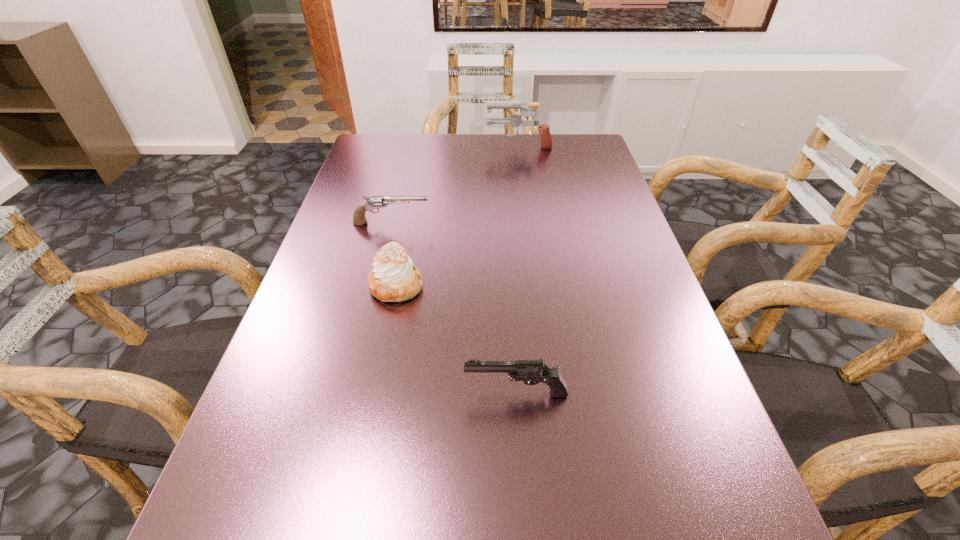
What are the coordinates of `vacant space located 0.330m at the end of the barrel of the nearest object` in the screenshot? It's located at (267, 393).

This screenshot has height=540, width=960. In order to click on vacant space situated 0.130m at the end of the barrel of the nearest object in this screenshot , I will do `click(387, 393)`.

Find the location of `vacant space located 0.170m at the end of the barrel of the nearest object`. vacant space located 0.170m at the end of the barrel of the nearest object is located at coordinates pyautogui.click(x=363, y=393).

Locate an element on the screen. This screenshot has height=540, width=960. free region located aiming along the barrel of the leftmost gun is located at coordinates (540, 223).

This screenshot has width=960, height=540. I want to click on object located in the far edge section of the desktop, so click(x=515, y=120).

Identify the location of pastry at the left edge. (393, 278).

Where is `gun at the left edge`? gun at the left edge is located at coordinates (374, 202).

Identify the location of object present at the right edge. The height and width of the screenshot is (540, 960). (515, 120).

Where is `object that is at the far right corner`? This screenshot has width=960, height=540. object that is at the far right corner is located at coordinates (515, 120).

You are a GUI agent. You are given a task and a screenshot of the screen. Output one action in this format:
    pyautogui.click(x=<x>, y=<y>)
    Task: Click on the vacant region at the far edge of the desktop
    Image resolution: width=960 pixels, height=540 pixels.
    Given the screenshot: What is the action you would take?
    pyautogui.click(x=458, y=137)